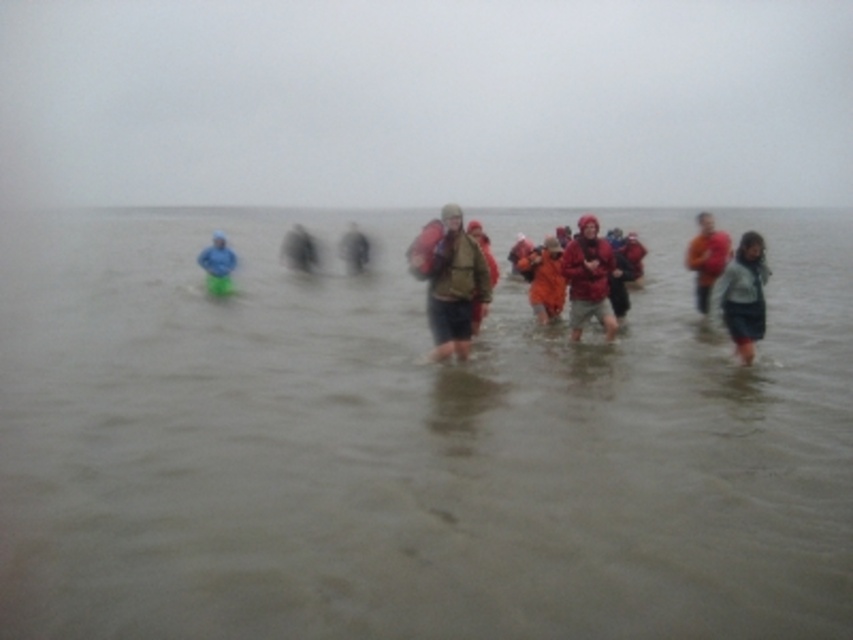
Question: Which of the following is the closest to the observer?

Choices:
 (A) (354, 259)
 (B) (554, 262)
 (C) (289, 260)

Answer: (B)

Question: Which of the following is the closest to the observer?

Choices:
 (A) red matte jacket at center
 (B) brown matte jacket at center

Answer: (B)

Question: Which object appears closest to the camera in this image?

Choices:
 (A) blue matte jacket at left
 (B) gray woolen scarf at lower right
 (C) matte black backpack at center
 (D) red fabric backpack at right

Answer: (B)

Question: Can you confirm if blue matte jacket at left is positioned below matte brown jacket at center?

Choices:
 (A) yes
 (B) no

Answer: (B)

Question: Does brown murky water at center have a smaller size compared to blue matte jacket at left?

Choices:
 (A) yes
 (B) no

Answer: (B)

Question: Is blue matte jacket at left below matte brown jacket at center?

Choices:
 (A) no
 (B) yes

Answer: (A)